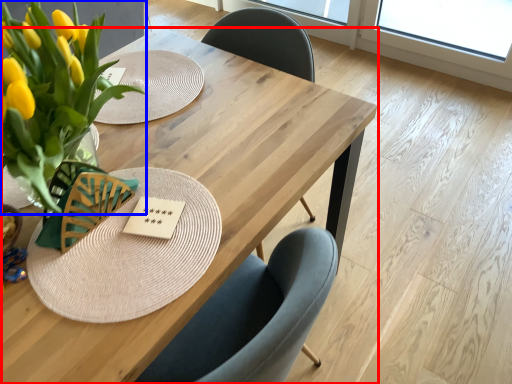
Question: Which point is closer to the camera, table (highlighted by a red box) or floral arrangement (highlighted by a blue box)?

Choices:
 (A) table
 (B) floral arrangement

Answer: (B)